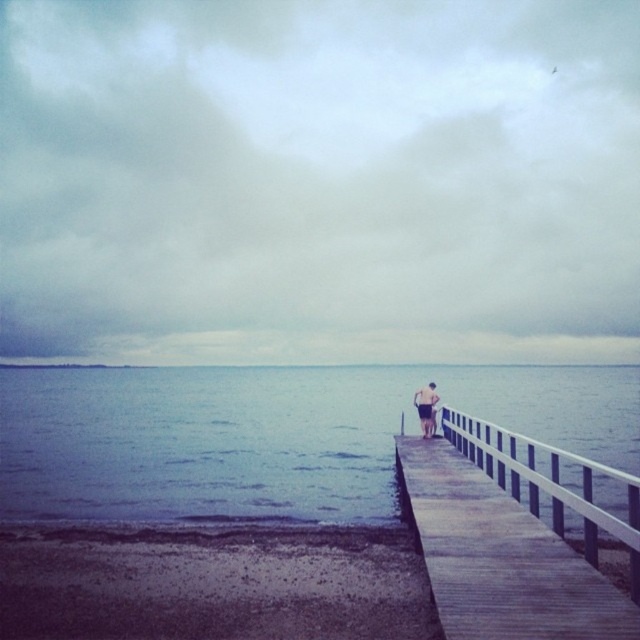
Question: Which is farther from the wooden dock at right?

Choices:
 (A) blue water at center
 (B) light brown wooden boardwalk at center

Answer: (A)

Question: Where is blue water at center located in relation to wooden dock at right in the image?

Choices:
 (A) right
 (B) left

Answer: (B)

Question: Is wooden dock at right to the left of light brown wooden boardwalk at center from the viewer's perspective?

Choices:
 (A) yes
 (B) no

Answer: (A)

Question: Is the position of blue water at center more distant than that of light brown wooden boardwalk at center?

Choices:
 (A) no
 (B) yes

Answer: (A)

Question: Considering the real-world distances, which object is farthest from the wooden dock at right?

Choices:
 (A) blue water at center
 (B) light brown wooden boardwalk at center

Answer: (A)

Question: Which point is farther from the camera taking this photo?

Choices:
 (A) (429, 428)
 (B) (464, 534)

Answer: (A)